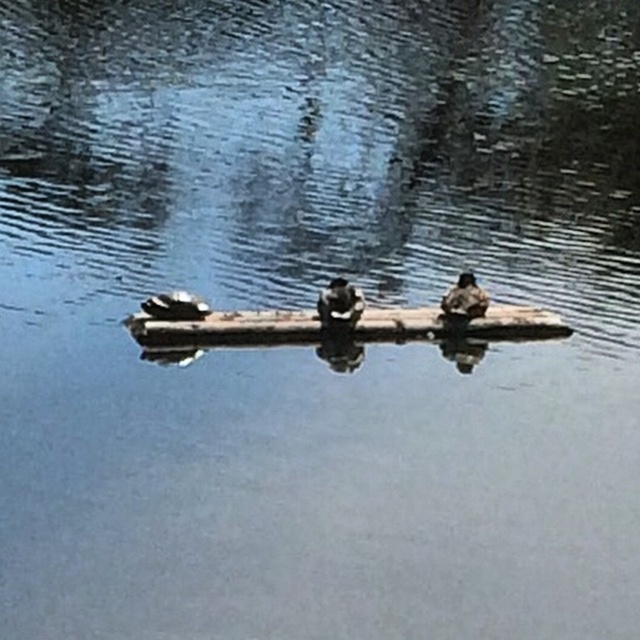
Question: Which point is farther to the camera?

Choices:
 (A) brown matte duck at center
 (B) dark brown feathers at center

Answer: (B)

Question: Can you confirm if brown matte duck at center is positioned to the left of dark brown feathers at center?

Choices:
 (A) no
 (B) yes

Answer: (A)

Question: Can you confirm if brown matte duck at center is bigger than dark brown feathers at center?

Choices:
 (A) yes
 (B) no

Answer: (A)

Question: Is brown matte duck at center thinner than dark brown feathers at center?

Choices:
 (A) yes
 (B) no

Answer: (A)

Question: Among these points, which one is farthest from the camera?

Choices:
 (A) (333, 291)
 (B) (188, 308)

Answer: (A)